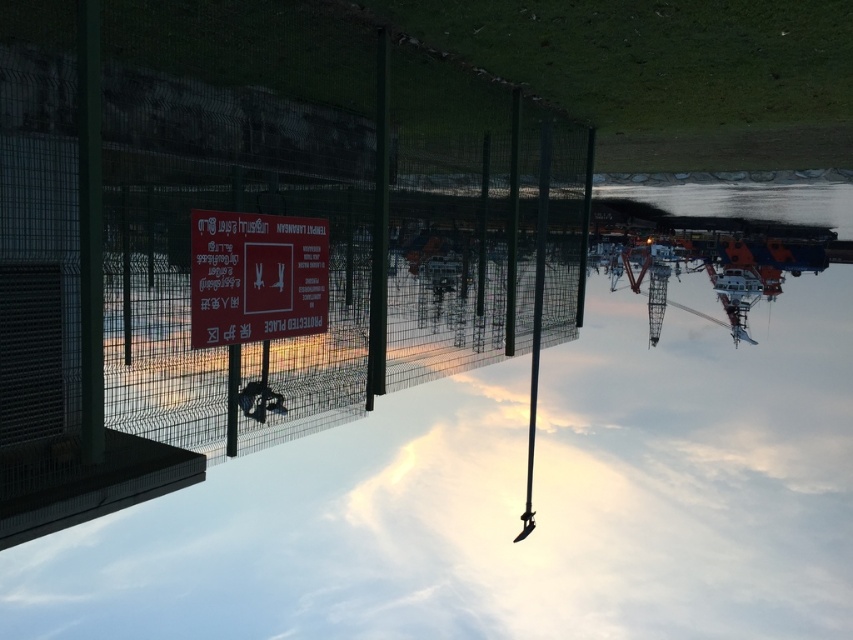
Between point (343, 19) and point (241, 240), which one is positioned in front?

Point (241, 240) is more forward.

Looking at this image, can you confirm if green wire mesh fence at center is thinner than matte red sign at center?

In fact, green wire mesh fence at center might be wider than matte red sign at center.

At what (x,y) coordinates should I click in order to perform the action: click on green wire mesh fence at center. Please return your answer as a coordinate pair (x, y). This screenshot has width=853, height=640. Looking at the image, I should click on (253, 236).